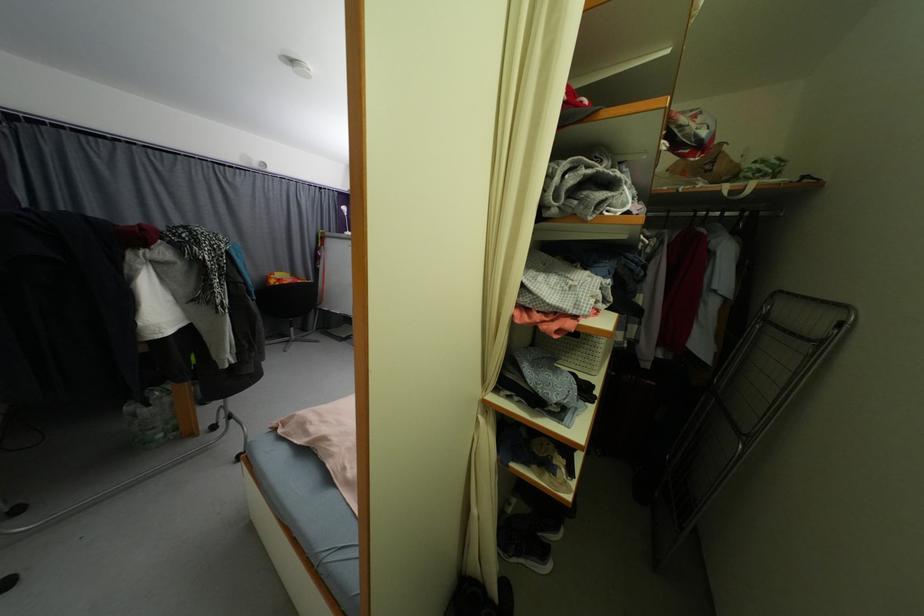
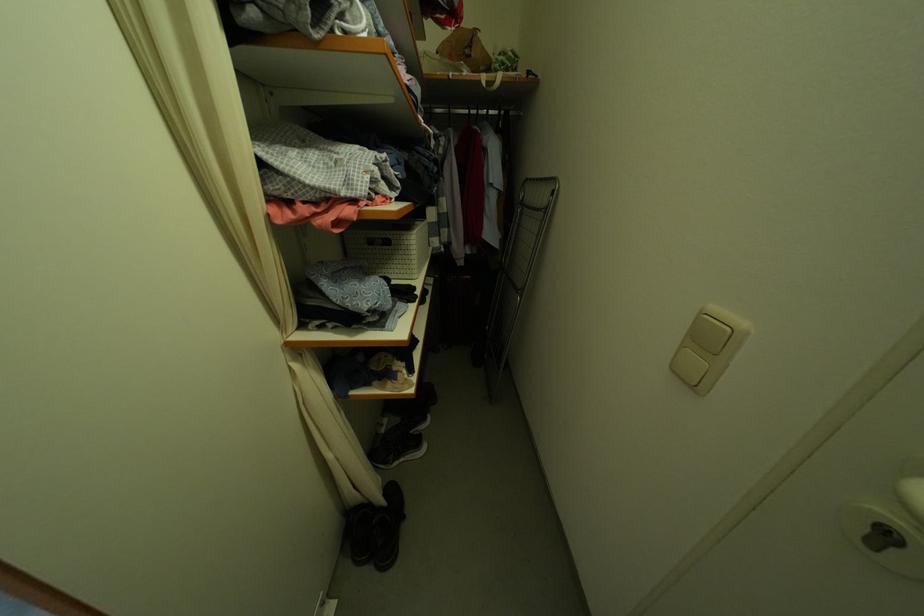
Find the pixel in the second image that matches point 508,588 in the first image.

(395, 490)